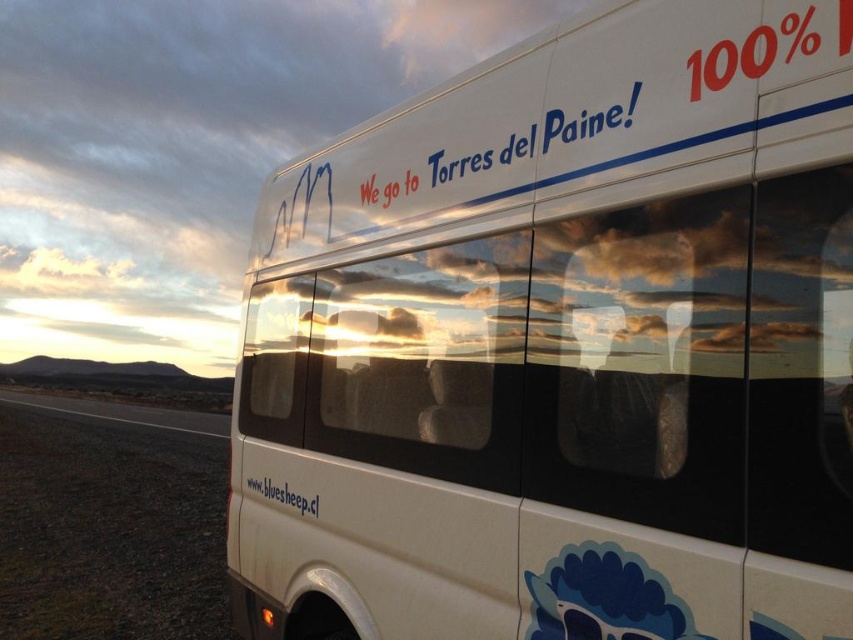
Does white matte bus at center have a greater width compared to white matte text at lower center?

In fact, white matte bus at center might be narrower than white matte text at lower center.

Locate an element on the screen. white matte bus at center is located at coordinates (563, 344).

What are the coordinates of `white matte bus at center` in the screenshot? It's located at (563, 344).